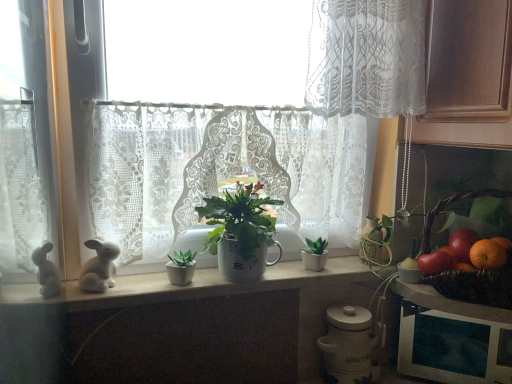
Question: Is brown woven basket at right inside white lace curtain at center, arranged as the second curtain when viewed from the right?

Choices:
 (A) yes
 (B) no

Answer: (B)

Question: Does white lace curtain at center, which is the first curtain in bottom-to-top order, appear on the left side of brown woven basket at right?

Choices:
 (A) no
 (B) yes

Answer: (B)

Question: Is white lace curtain at center, which is the first curtain in bottom-to-top order, positioned in front of brown woven basket at right?

Choices:
 (A) no
 (B) yes

Answer: (A)

Question: Can we say white lace curtain at center, the second curtain positioned from the top, lies outside brown woven basket at right?

Choices:
 (A) yes
 (B) no

Answer: (A)

Question: Does white lace curtain at center, which is the first curtain in bottom-to-top order, have a lesser height compared to brown woven basket at right?

Choices:
 (A) no
 (B) yes

Answer: (A)

Question: Is white matte counter top at center spatially inside shiny red tomato at right, which ranks as the first fruit in left-to-right order, or outside of it?

Choices:
 (A) inside
 (B) outside

Answer: (B)

Question: In terms of height, does white matte counter top at center look taller or shorter compared to shiny red tomato at right, which ranks as the first fruit in left-to-right order?

Choices:
 (A) short
 (B) tall

Answer: (A)

Question: Considering the positions of white matte counter top at center and shiny red tomato at right, which ranks as the first fruit in left-to-right order, in the image, is white matte counter top at center wider or thinner than shiny red tomato at right, which ranks as the first fruit in left-to-right order,?

Choices:
 (A) wide
 (B) thin

Answer: (A)

Question: From a real-world perspective, is white matte counter top at center above or below shiny red tomato at right, which ranks as the first fruit in left-to-right order?

Choices:
 (A) below
 (B) above

Answer: (A)

Question: From a real-world perspective, is shiny red tomato at right, which ranks as the first fruit in left-to-right order, positioned above or below white lace curtain at center, the second curtain positioned from the top?

Choices:
 (A) below
 (B) above

Answer: (A)

Question: Based on their positions, is shiny red tomato at right, which appears as the 2th fruit when viewed from the right, located to the left or right of white lace curtain at center, which appears as the 1th curtain when viewed from the left?

Choices:
 (A) left
 (B) right

Answer: (B)

Question: Considering the positions of point (443, 251) and point (298, 193), is point (443, 251) closer or farther from the camera than point (298, 193)?

Choices:
 (A) closer
 (B) farther

Answer: (A)

Question: Is shiny red tomato at right, which appears as the 2th fruit when viewed from the right, bigger or smaller than white lace curtain at center, arranged as the second curtain when viewed from the right?

Choices:
 (A) small
 (B) big

Answer: (A)

Question: Is white ceramic mug at center bigger or smaller than white lace curtain at upper center, the second curtain positioned from the left?

Choices:
 (A) big
 (B) small

Answer: (B)

Question: Considering the positions of white ceramic mug at center and white lace curtain at upper center, the second curtain positioned from the left, in the image, is white ceramic mug at center taller or shorter than white lace curtain at upper center, the second curtain positioned from the left,?

Choices:
 (A) short
 (B) tall

Answer: (A)